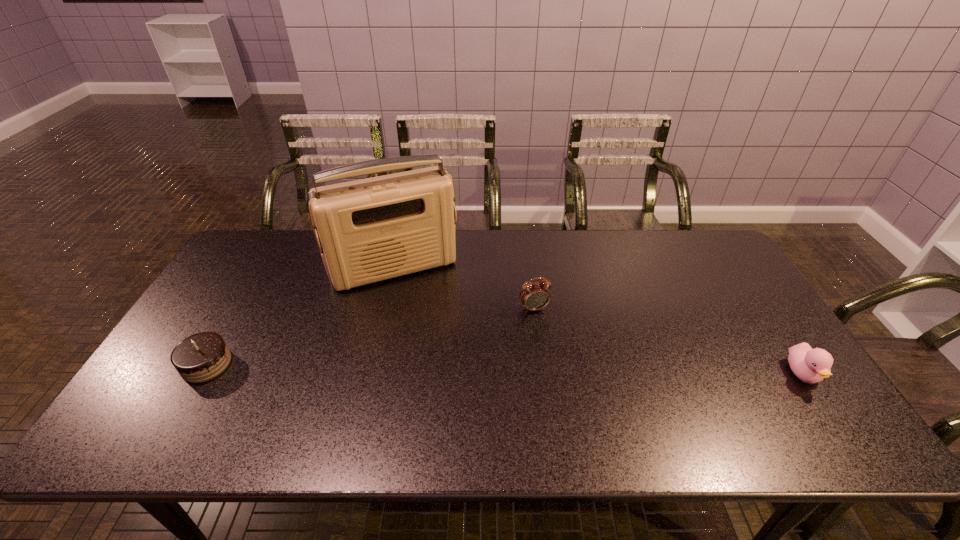
You are a GUI agent. You are given a task and a screenshot of the screen. Output one action in this format:
    pyautogui.click(x=<x>, y=<y>)
    Task: Click on the chocolate cake
    The height and width of the screenshot is (540, 960).
    Given the screenshot: What is the action you would take?
    pyautogui.click(x=203, y=356)

Identify the location of duckling. The width and height of the screenshot is (960, 540). (810, 365).

At what (x,y) coordinates should I click in order to perform the action: click on the farthest object. Please return your answer as a coordinate pair (x, y). This screenshot has height=540, width=960. Looking at the image, I should click on (369, 230).

The image size is (960, 540). Find the location of `the third object from right to left`. the third object from right to left is located at coordinates (369, 230).

At what (x,y) coordinates should I click in order to perform the action: click on the second object from right to left. Please return your answer as a coordinate pair (x, y). This screenshot has width=960, height=540. Looking at the image, I should click on (534, 296).

Locate an element on the screen. The image size is (960, 540). the second farthest object is located at coordinates (534, 296).

Find the location of a particular element. This screenshot has height=540, width=960. vacant space situated on the back of the chocolate cake is located at coordinates (238, 309).

Image resolution: width=960 pixels, height=540 pixels. What are the coordinates of `vacant region located 0.050m on the front-facing side of the rightmost object` in the screenshot? It's located at (828, 413).

Where is `free space located 0.100m on the front-facing side of the second object from left to right`? The height and width of the screenshot is (540, 960). free space located 0.100m on the front-facing side of the second object from left to right is located at coordinates (424, 314).

The height and width of the screenshot is (540, 960). Find the location of `vacant space situated 0.300m on the front-facing side of the second object from left to right`. vacant space situated 0.300m on the front-facing side of the second object from left to right is located at coordinates (446, 366).